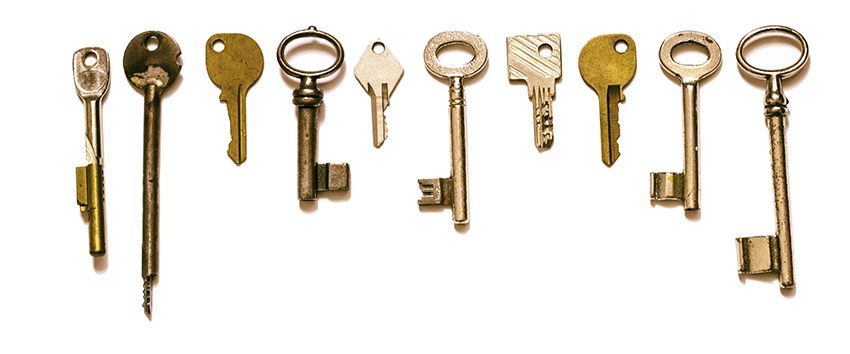
You are a GUI agent. You are given a task and a screenshot of the screen. Output one action in this format:
    pyautogui.click(x=<x>, y=<y>)
    Task: Click on the keys
    This screenshot has height=354, width=850.
    Given the screenshot: What is the action you would take?
    pos(92,79), pos(150,69), pos(235,71), pos(312,72), pos(382,73), pos(452,71), pos(530,74), pos(604,70), pos(684,71), pos(766,69)